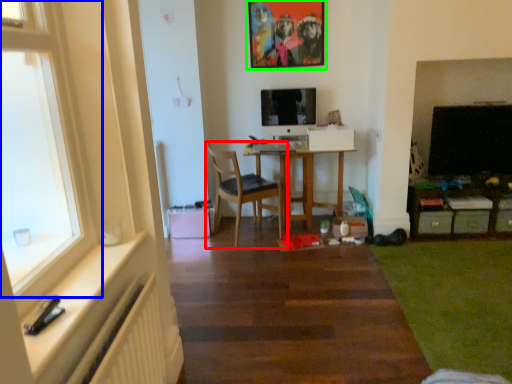
Question: Considering the real-world distances, which object is closest to chair (highlighted by a red box)? window (highlighted by a blue box) or picture frame (highlighted by a green box).

Choices:
 (A) window
 (B) picture frame

Answer: (B)